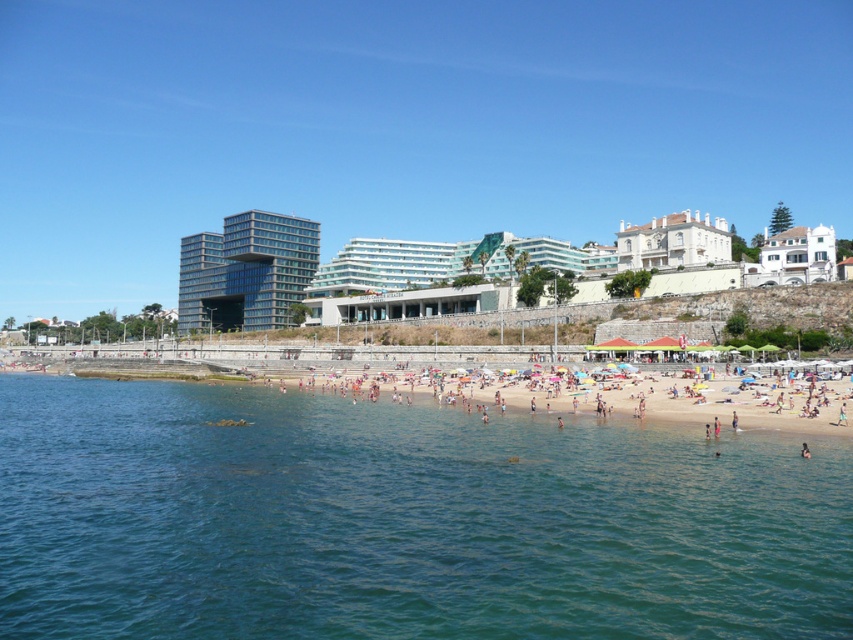
Consider the image. You are standing on the beach and want to take a photo of the white matte house at upper right without including the clear blue water at beach center in the frame. Which direction should you move to achieve this?

You should move to the right side away from the clear blue water at beach center, as it is located to the left of the white matte house at upper right. This way, shifting your position to the right will help exclude the water from the photo frame.

You are standing at the beach and see a point marked at coordinates (403, 520). Based on the scene description, what is the location of this point relative to the beach and water?

The point at (403, 520) is located on the clear blue water at the beach center.

You are standing on the beach and want to take a photo of the glassy modern building at center. If your camera can focus on objects up to 500 feet away, will you need to move closer to get a clear shot?

The glassy modern building at center is 557.67 feet away from the viewer, which is beyond the camera focus range of 500 feet. Therefore, you need to move closer to ensure the building is within the camera focus range.